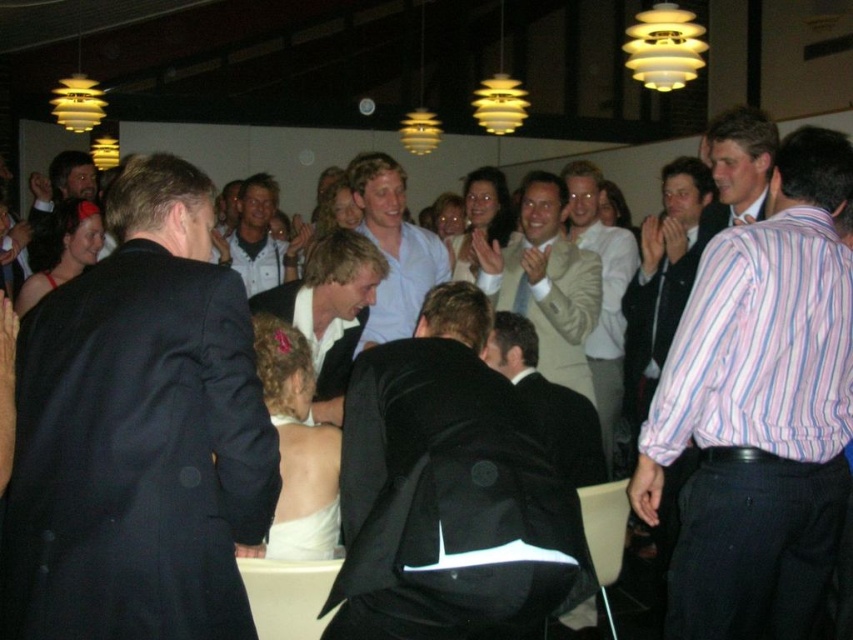
Question: Among these points, which one is nearest to the camera?

Choices:
 (A) (50, 186)
 (B) (383, 184)
 (C) (209, 538)

Answer: (C)

Question: Among these points, which one is nearest to the camera?

Choices:
 (A) (93, 198)
 (B) (258, 273)
 (C) (544, 388)
 (D) (193, 440)

Answer: (D)

Question: Is black suit at center further to the viewer compared to light brown leather jacket at center?

Choices:
 (A) yes
 (B) no

Answer: (B)

Question: Does light beige textured blazer at center appear on the left side of matte black suit at lower left?

Choices:
 (A) no
 (B) yes

Answer: (A)

Question: Among these points, which one is farthest from the camera?

Choices:
 (A) (376, 220)
 (B) (349, 248)
 (C) (283, 257)

Answer: (C)

Question: Does black suit at left lie in front of light brown leather jacket at center?

Choices:
 (A) yes
 (B) no

Answer: (A)